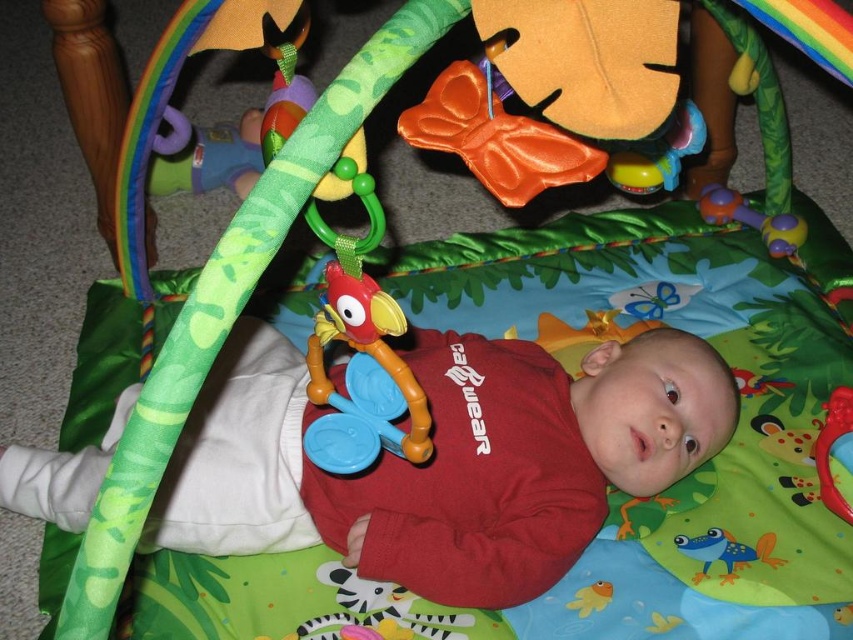
You are a parent checking the safety of the baby play area. The rubberized plastic bird at center and the rubberized purple rattle at upper right are both part of the hanging activity center. Which of these two toys is closer to the baby?

The rubberized plastic bird at center is positioned under the rubberized purple rattle at upper right, so the bird is closer to the baby than the rattle.

From the picture: You are a parent holding a baby and want to place a toy on the play mat so that it is exactly 34.53 inches away from the baby. The play mat has a point marked at coordinates point (386, 344). Can you place the toy at that point to meet the requirement?

Yes, placing the toy at point (386, 344) will satisfy the requirement because the point is exactly 34.53 inches away from the baby.

From the picture: You are a parent trying to grab the rubberized purple rattle at upper right from the hanging activity center above the baby. Can you reach it without moving the red matte baby at center?

The red matte baby at center is in front of the rubberized purple rattle at upper right, so you can reach the rubberized purple rattle at upper right without moving the baby because it is behind the baby.